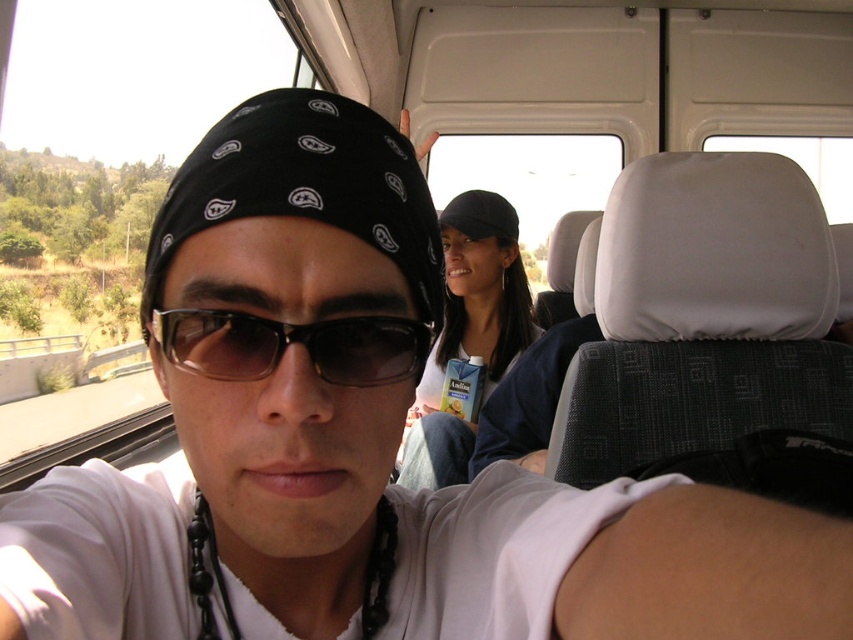
Question: Is matte black cap at center smaller than black plastic sunglasses at center?

Choices:
 (A) yes
 (B) no

Answer: (B)

Question: Which point appears closest to the camera in this image?

Choices:
 (A) (432, 476)
 (B) (262, 378)

Answer: (B)

Question: Is matte black cap at center above black plastic sunglasses at center?

Choices:
 (A) yes
 (B) no

Answer: (B)

Question: Which point is farther to the camera?

Choices:
 (A) (210, 376)
 (B) (494, 291)

Answer: (B)

Question: Can you confirm if matte black cap at center is wider than black plastic sunglasses at center?

Choices:
 (A) no
 (B) yes

Answer: (B)